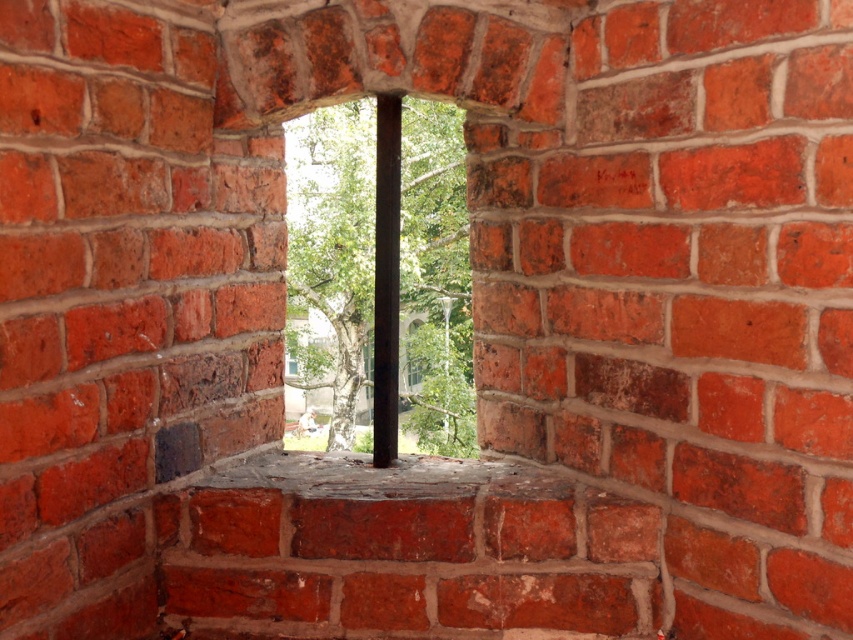
You are an architect designing a new building and want to incorporate both a transparent glass window at center and a metallic gray hole at lower left into the design. Which of the two has a greater width according to the scene?

The transparent glass window at center has a greater width than the metallic gray hole at lower left as stated in the objects description.